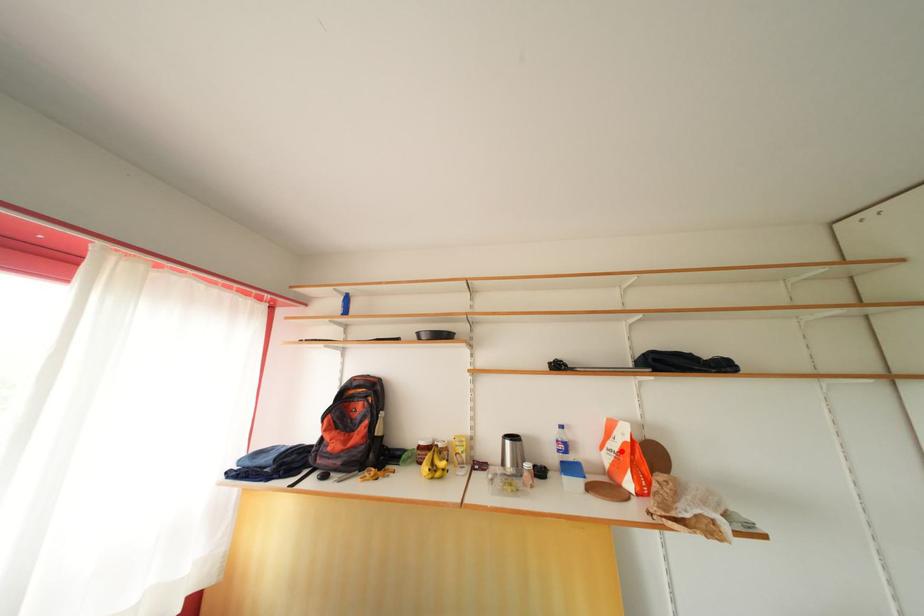
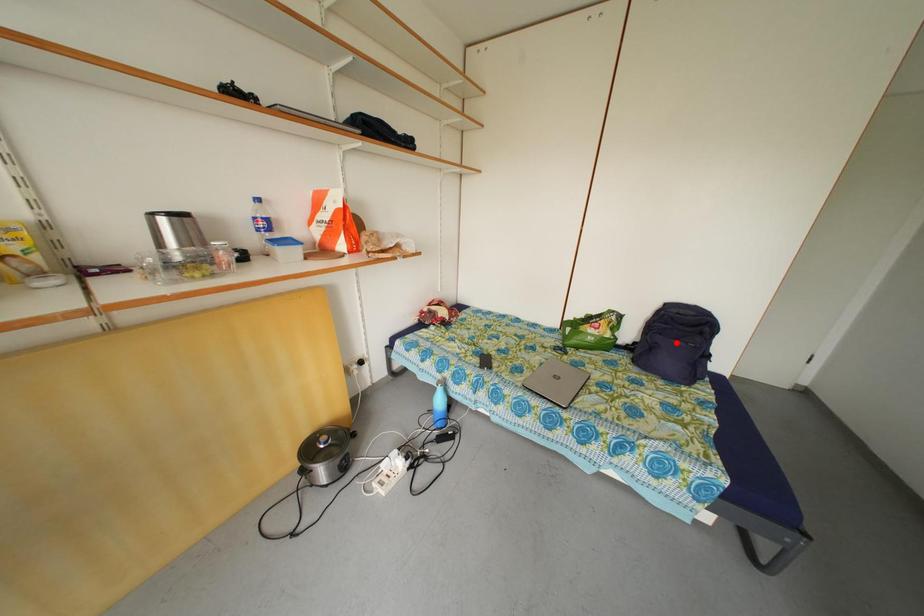
I am providing you with two images of the same scene from different viewpoints. A red point is marked on the first image and another point is marked on the second image. Do the highlighted points in image1 and image2 indicate the same real-world spot?

No